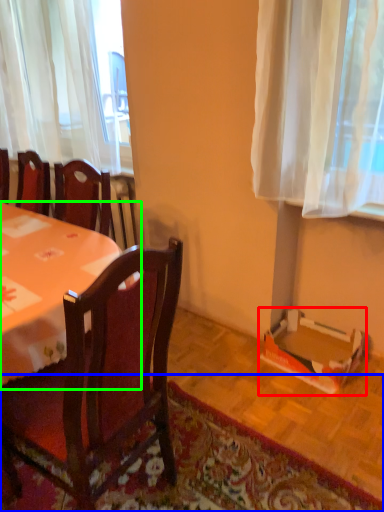
Question: Estimate the real-world distances between objects in this image. Which object is closer to cardboard box (highlighted by a red box), mat (highlighted by a blue box) or desk (highlighted by a green box)?

Choices:
 (A) mat
 (B) desk

Answer: (A)